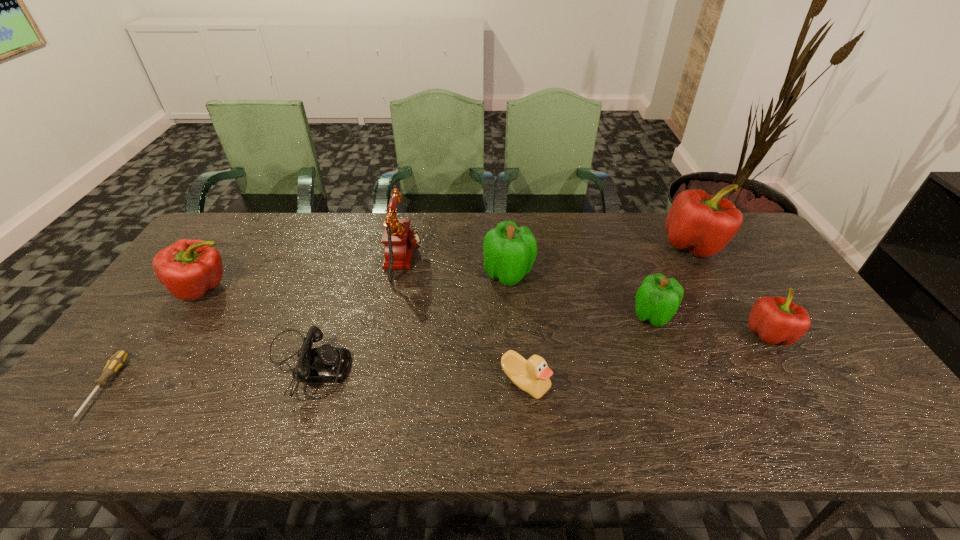
Image resolution: width=960 pixels, height=540 pixels. I want to click on vacant area that lies between the shortest object and the nearest pink bell pepper, so click(x=437, y=361).

The width and height of the screenshot is (960, 540). I want to click on empty space between the shorter telephone and the seventh object from left to right, so click(x=479, y=340).

Locate an element on the screen. The height and width of the screenshot is (540, 960). vacant space in between the third bell pepper from left to right and the leftmost bell pepper is located at coordinates (427, 302).

What are the coordinates of `free area in between the duck and the smallest pink bell pepper` in the screenshot? It's located at (647, 359).

Identify the location of object that stands as the third closest to the farthest pink bell pepper. (509, 251).

Find the location of a particular element. The width and height of the screenshot is (960, 540). object that stands as the seventh closest to the beige duck is located at coordinates (188, 268).

Choose which bell pepper is the third nearest neighbor to the fourth object from left to right. Please provide its 2D coordinates. Your answer should be formatted as a tuple, i.e. [(x, y)], where the tuple contains the x and y coordinates of a point satisfying the conditions above.

[(657, 300)]

Locate an element on the screen. This screenshot has height=540, width=960. bell pepper that is the nearest to the leftmost pink bell pepper is located at coordinates (509, 251).

Identify which pink bell pepper is the third closest to the left telephone. Please provide its 2D coordinates. Your answer should be formatted as a tuple, i.e. [(x, y)], where the tuple contains the x and y coordinates of a point satisfying the conditions above.

[(776, 320)]

Where is `the closest pink bell pepper to the beige duck`? The width and height of the screenshot is (960, 540). the closest pink bell pepper to the beige duck is located at coordinates (776, 320).